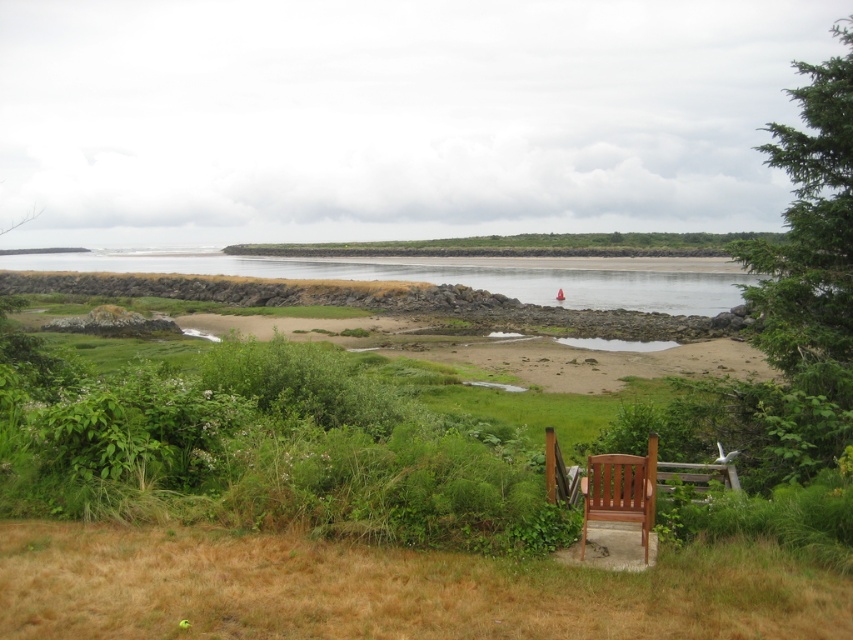
Question: Can you confirm if brown dry grass at lower center is thinner than wooden chair at lower center?

Choices:
 (A) no
 (B) yes

Answer: (A)

Question: Considering the real-world distances, which object is closest to the brown dry grass at lower center?

Choices:
 (A) wooden chair at lower center
 (B) brown wood chair at center

Answer: (B)

Question: Which point is farther to the camera?

Choices:
 (A) brown dry grass at lower center
 (B) wooden chair at lower center
 (C) brown wood chair at center

Answer: (B)

Question: Among these objects, which one is farthest from the camera?

Choices:
 (A) wooden chair at lower center
 (B) brown dry grass at lower center

Answer: (A)

Question: Does brown dry grass at lower center have a larger size compared to brown wood chair at center?

Choices:
 (A) yes
 (B) no

Answer: (A)

Question: Is brown dry grass at lower center in front of brown wood chair at center?

Choices:
 (A) yes
 (B) no

Answer: (A)